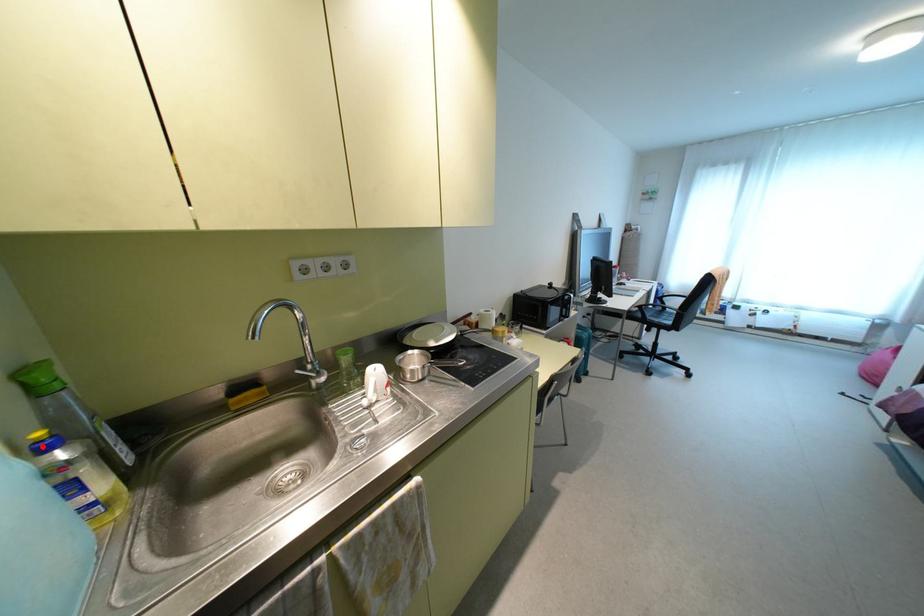
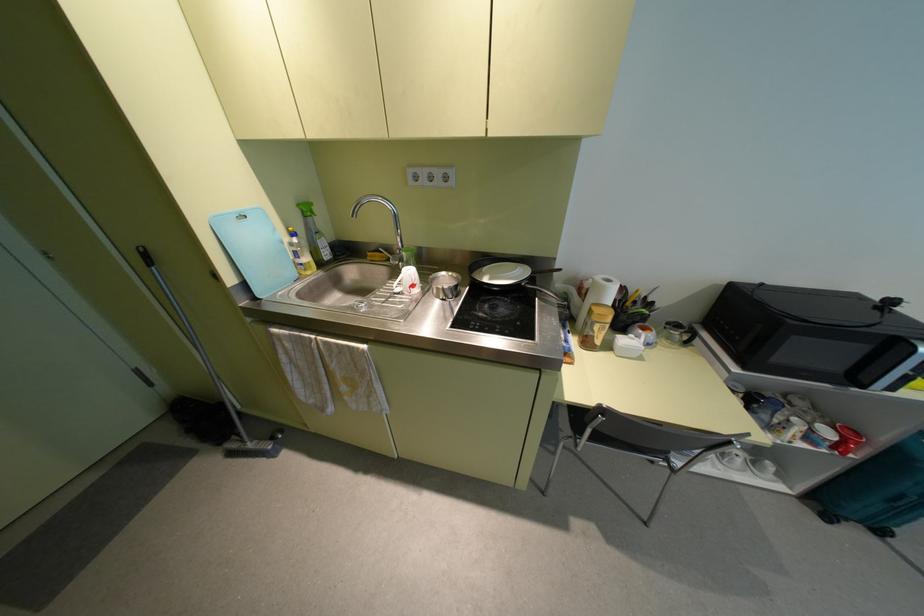
Question: I am providing you with two images of the same scene from different viewpoints. Image1 has a red point marked. In image2, the corresponding 3D location appears at what relative position? Reply with the corresponding letter.

Choices:
 (A) Closer
 (B) Farther

Answer: (A)